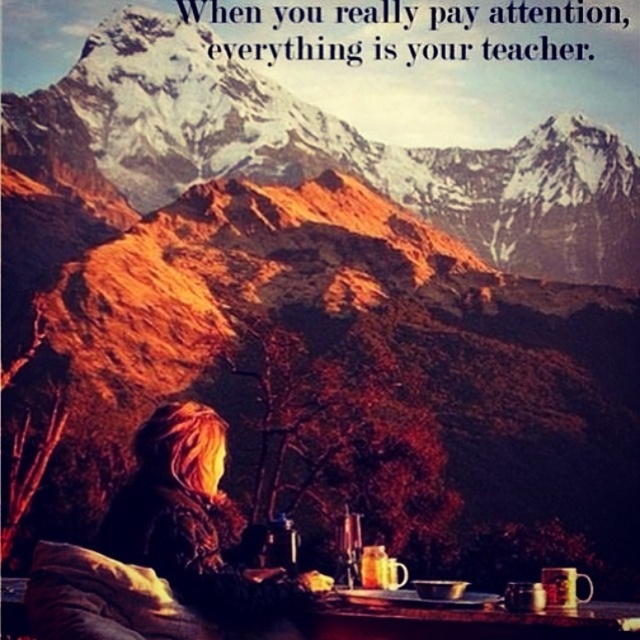
You are a photographer trying to capture the scene of the person sitting at the table in the mountain landscape. You want to ensure both the shiny brown jacket at lower left and the white paper at upper center are clearly visible in your shot. Based on their positions, which object should you focus on first to ensure both are in frame?

The shiny brown jacket at lower left is located below the white paper at upper center. To ensure both are in frame, focus on the white paper at upper center first as it is higher up, allowing the jacket to naturally fall into the lower portion of the shot.

You are an artist planning to sketch the snowy granite mountain at upper center and the white paper at upper center. Given their positions and sizes in the scene, which object should you start with to ensure proper perspective, and why?

You should start with the snowy granite mountain at upper center because it is taller than the white paper at upper center, so drawing it first will help establish the vertical scale and perspective relationship between the two objects.

You are a hiker who wants to take a photo of the snowy granite mountain at upper center and the white paper at upper center in the same frame. Given that your camera has a maximum focus range of 70 feet, will you be able to capture both objects in focus simultaneously?

The snowy granite mountain at upper center is 74.40 feet away from the white paper at upper center. Since the camera can only focus up to 70 feet, the distance between them exceeds the camera s maximum focus range. Therefore, you won t be able to capture both objects in focus at the same time.